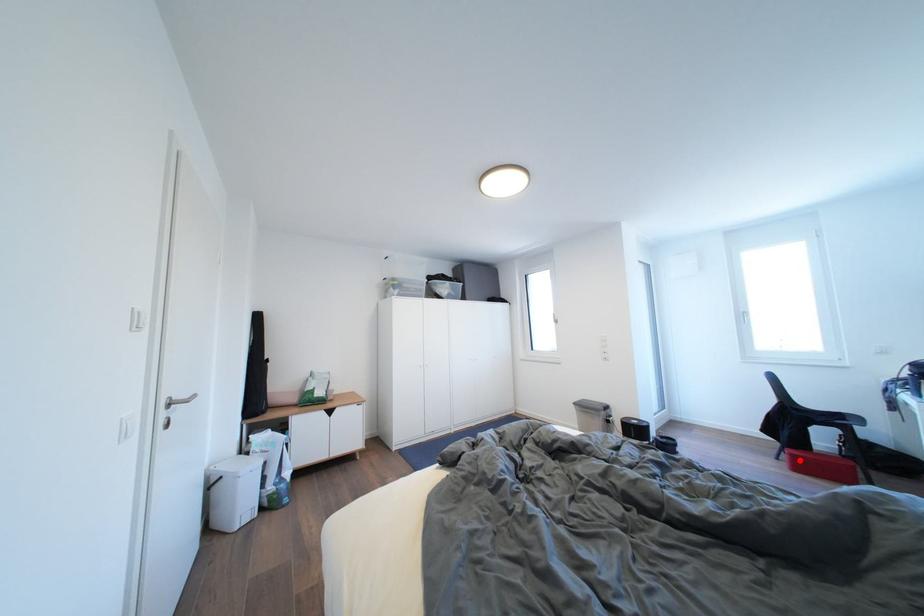
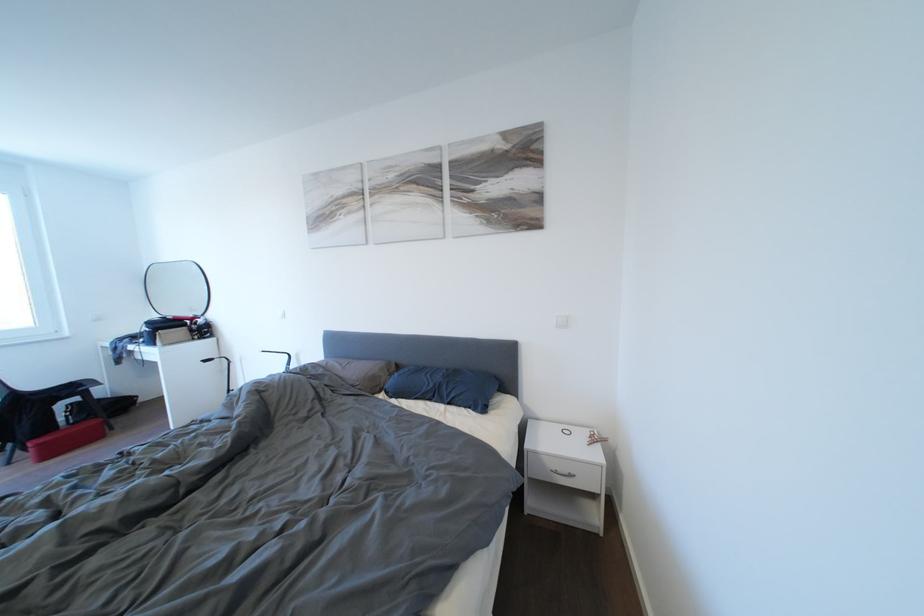
Question: I am providing you with two images of the same scene from different viewpoints. Given a red point in image1, look at the same physical point in image2. Is it:

Choices:
 (A) Closer to the viewpoint
 (B) Farther from the viewpoint

Answer: (A)